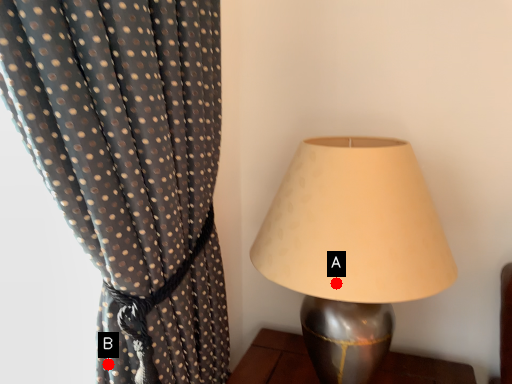
Question: Two points are circled on the image, labeled by A and B beside each circle. Which point appears farthest from the camera in this image?

Choices:
 (A) A is further
 (B) B is further

Answer: (A)